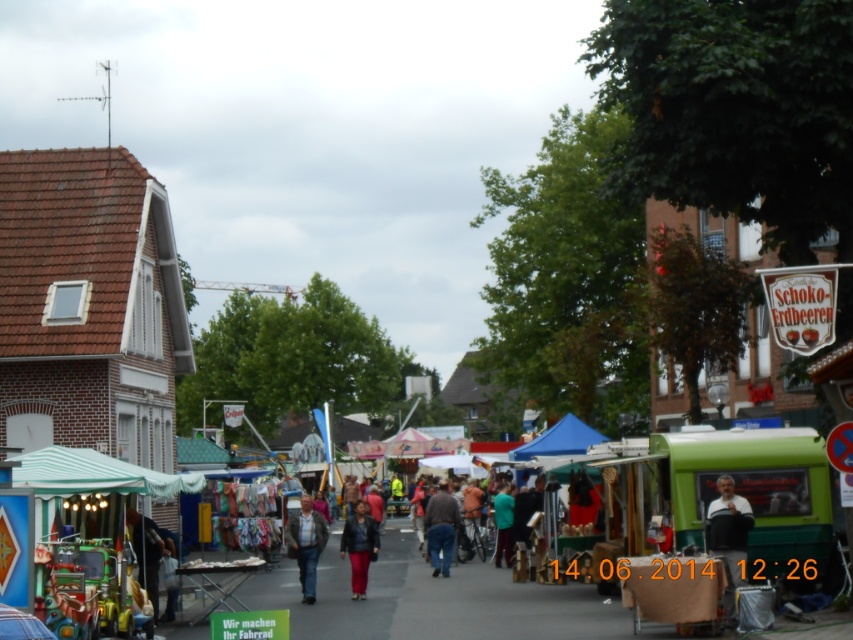
From the picture: You are a customer at the market and want to pick up the dark gray sweater at center. The green fabric stall at center is blocking your path. Can you walk around the stall to reach the sweater?

The green fabric stall at center might be wider than dark gray sweater at center, so it is possible that the stall is blocking the path. However, since the exact width isn t specified, it s uncertain whether you can walk around it. You may need to check the actual dimensions on site.